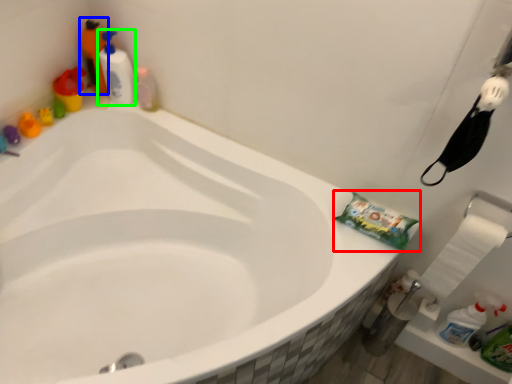
Question: Based on their relative distances, which object is farther from material (highlighted by a red box)? Choose from cleaning product (highlighted by a blue box) and cleaning product (highlighted by a green box).

Choices:
 (A) cleaning product
 (B) cleaning product

Answer: (A)